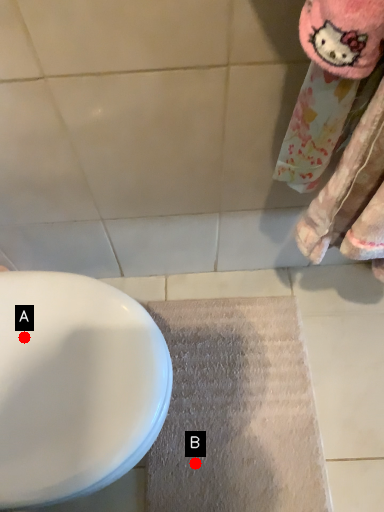
Question: Two points are circled on the image, labeled by A and B beside each circle. Among these points, which one is nearest to the camera?

Choices:
 (A) A is closer
 (B) B is closer

Answer: (A)